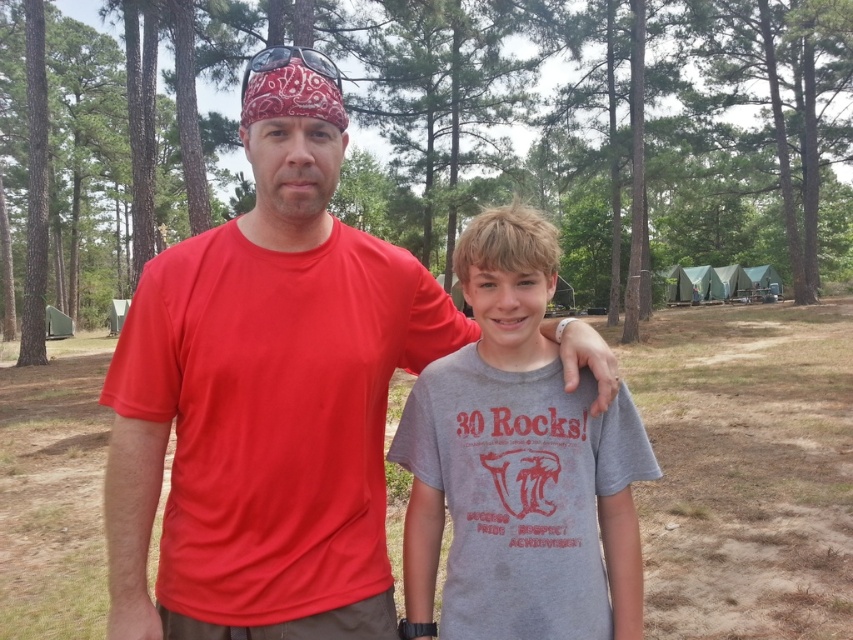
Question: Is matte red t-shirt at center positioned before gray cotton t-shirt at center?

Choices:
 (A) no
 (B) yes

Answer: (B)

Question: Is matte red t-shirt at center wider than gray cotton t-shirt at center?

Choices:
 (A) yes
 (B) no

Answer: (A)

Question: Among these points, which one is nearest to the camera?

Choices:
 (A) (202, 381)
 (B) (521, 557)

Answer: (A)

Question: Which of the following is the farthest from the observer?

Choices:
 (A) (608, 480)
 (B) (149, 484)

Answer: (A)

Question: Considering the relative positions of matte red t-shirt at center and gray cotton t-shirt at center in the image provided, where is matte red t-shirt at center located with respect to gray cotton t-shirt at center?

Choices:
 (A) left
 (B) right

Answer: (A)